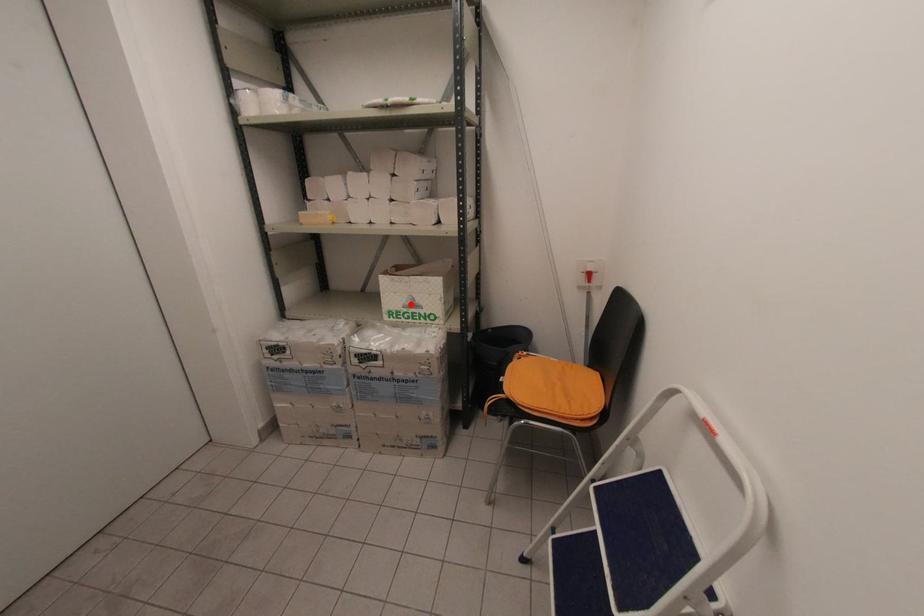
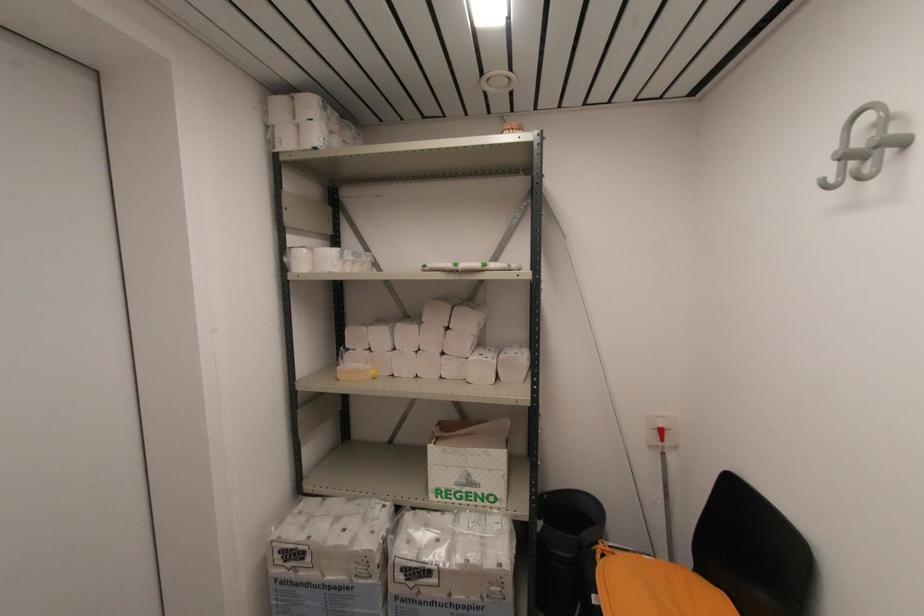
Where in the second image is the point corresponding to the highlighted location from the first image?

(465, 480)